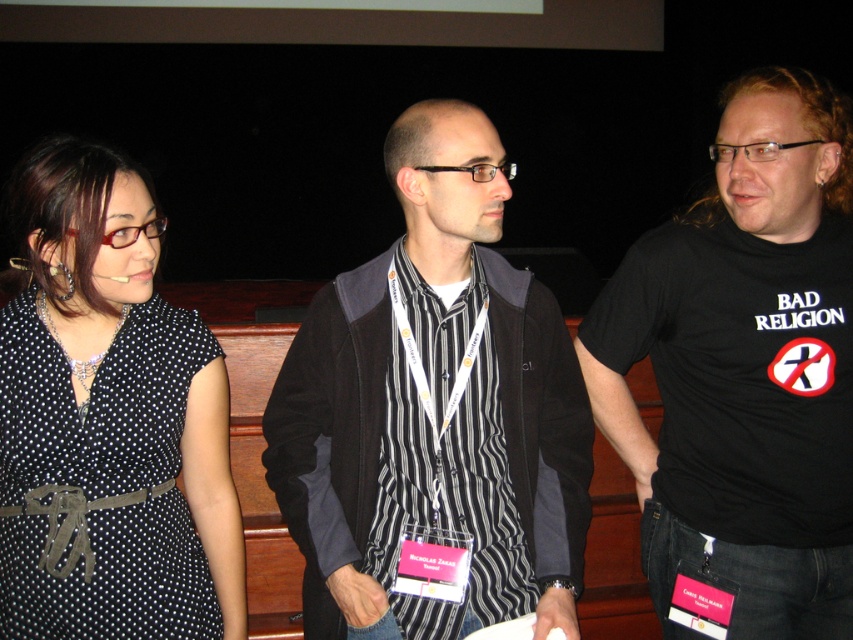
Question: Does black t-shirt at right have a larger size compared to polka dot fabric dress at left?

Choices:
 (A) no
 (B) yes

Answer: (B)

Question: Which is farther from the black striped shirt at center?

Choices:
 (A) striped fabric shirt at center
 (B) black t-shirt at right

Answer: (B)

Question: Estimate the real-world distances between objects in this image. Which object is farther from the striped fabric shirt at center?

Choices:
 (A) black striped shirt at center
 (B) black t-shirt at right
 (C) polka dot fabric dress at left

Answer: (B)

Question: Does black t-shirt at right appear under black striped shirt at center?

Choices:
 (A) no
 (B) yes

Answer: (A)

Question: Among these objects, which one is farthest from the camera?

Choices:
 (A) polka dot fabric dress at left
 (B) black striped shirt at center

Answer: (B)

Question: Does striped fabric shirt at center appear on the left side of polka dot fabric dress at left?

Choices:
 (A) no
 (B) yes

Answer: (A)